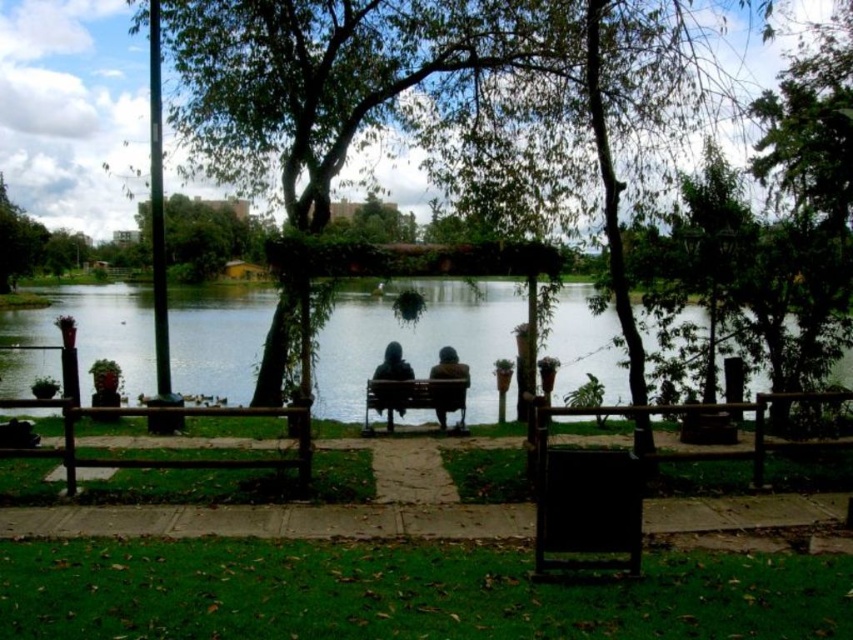
How far apart are brown wooden bench at center and dark brown leather bench at center?

They are 3.11 meters apart.

Based on the photo, does brown wooden bench at center have a lesser height compared to dark brown leather bench at center?

Yes.

Does point (195, 464) lie in front of point (463, 381)?

Yes.

I want to click on brown wooden bench at center, so click(158, 417).

Who is positioned more to the right, transparent glass lake at center or dark green hooded jacket at center?

dark green hooded jacket at center is more to the right.

Which of these two, transparent glass lake at center or dark green hooded jacket at center, stands shorter?

dark green hooded jacket at center

Locate an element on the screen. This screenshot has height=640, width=853. transparent glass lake at center is located at coordinates (416, 342).

Describe the element at coordinates (158, 417) in the screenshot. The width and height of the screenshot is (853, 640). I see `brown wooden bench at center` at that location.

Is point (57, 454) farther from viewer compared to point (395, 358)?

No, (57, 454) is in front of (395, 358).

In order to click on brown wooden bench at center in this screenshot , I will do `click(158, 417)`.

At what (x,y) coordinates should I click in order to perform the action: click on brown wooden bench at center. Please return your answer as a coordinate pair (x, y). Looking at the image, I should click on click(x=158, y=417).